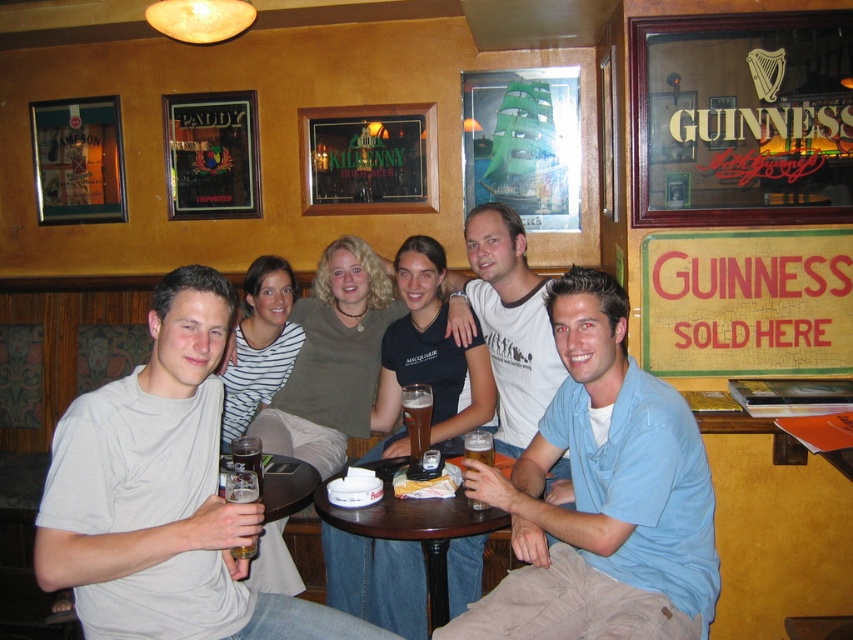
Who is more distant from viewer, (74, 467) or (465, 528)?

Point (465, 528)

Does light gray t-shirt at center have a larger size compared to brown wooden table at center?

Incorrect, light gray t-shirt at center is not larger than brown wooden table at center.

Is point (242, 620) farther from camera compared to point (320, 488)?

That is False.

You are a GUI agent. You are given a task and a screenshot of the screen. Output one action in this format:
    pyautogui.click(x=<x>, y=<y>)
    Task: Click on the light gray t-shirt at center
    This screenshot has height=640, width=853.
    Given the screenshot: What is the action you would take?
    pyautogui.click(x=163, y=496)

Between white cotton t-shirt at center and brown glass beer at center, which one is positioned lower?

Positioned lower is brown glass beer at center.

Between white cotton t-shirt at center and brown glass beer at center, which one appears on the left side from the viewer's perspective?

Positioned to the left is brown glass beer at center.

Who is more distant from viewer, (495, 362) or (421, 396)?

The point (495, 362) is more distant.

Find the location of a particular element. This screenshot has width=853, height=640. white cotton t-shirt at center is located at coordinates (506, 321).

Does blue cotton shirt at center appear on the left side of brown glass beer at center?

No, blue cotton shirt at center is not to the left of brown glass beer at center.

Which is more to the right, blue cotton shirt at center or brown glass beer at center?

From the viewer's perspective, blue cotton shirt at center appears more on the right side.

Who is more distant from viewer, [527,566] or [416,444]?

Positioned behind is point [416,444].

This screenshot has height=640, width=853. I want to click on blue cotton shirt at center, so click(x=602, y=497).